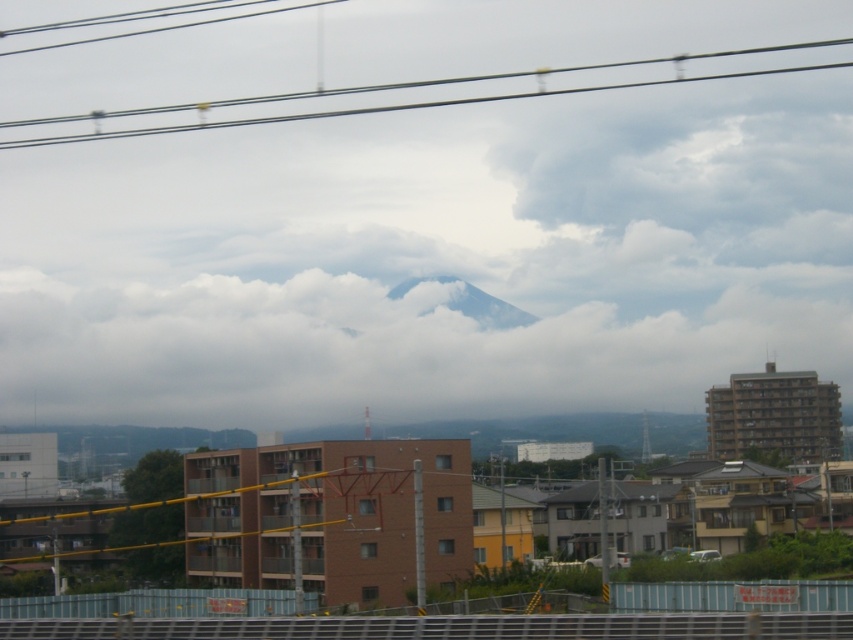
You are a drone operator planning to capture aerial footage of the mountain and the surrounding buildings. The drone has a maximum flight altitude of 300 meters. Considering the white fluffy cloud at center, will the drone be able to fly above it to get a clear shot of the mountain peak?

The white fluffy cloud at center is 338.06 meters from the camera. Since the drone can only fly up to 300 meters, it cannot reach above the cloud and will not be able to get a clear shot of the mountain peak.

You are a photographer planning to capture the iconic Mount Fuji in the background with the residential buildings in the foreground. You notice the white fluffy cloud at center and the metallic wire at upper center in your frame. Based on their positions, which object is closer to the left side of your camera view?

The white fluffy cloud at center is to the left of the metallic wire at upper center, so the white fluffy cloud at center is closer to the left side of the camera view.